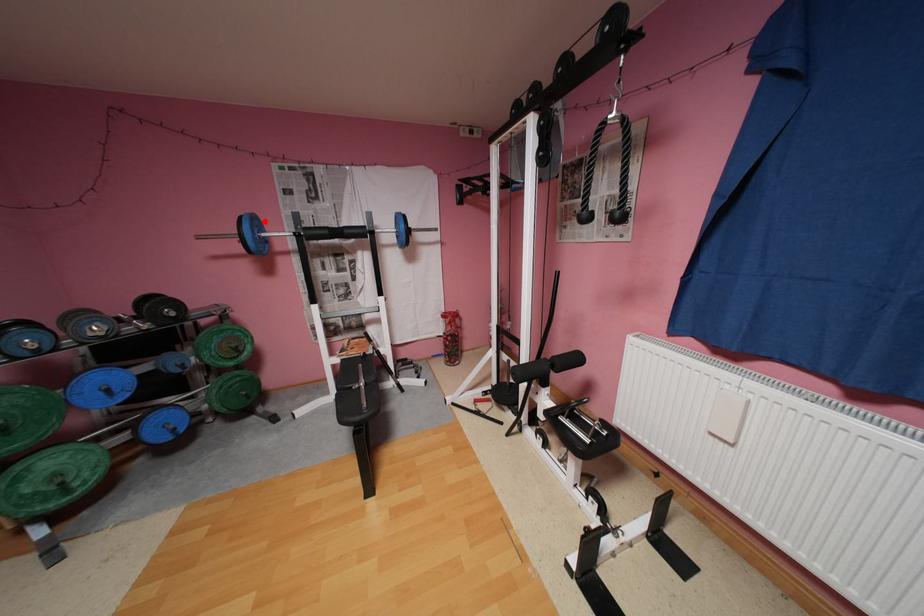
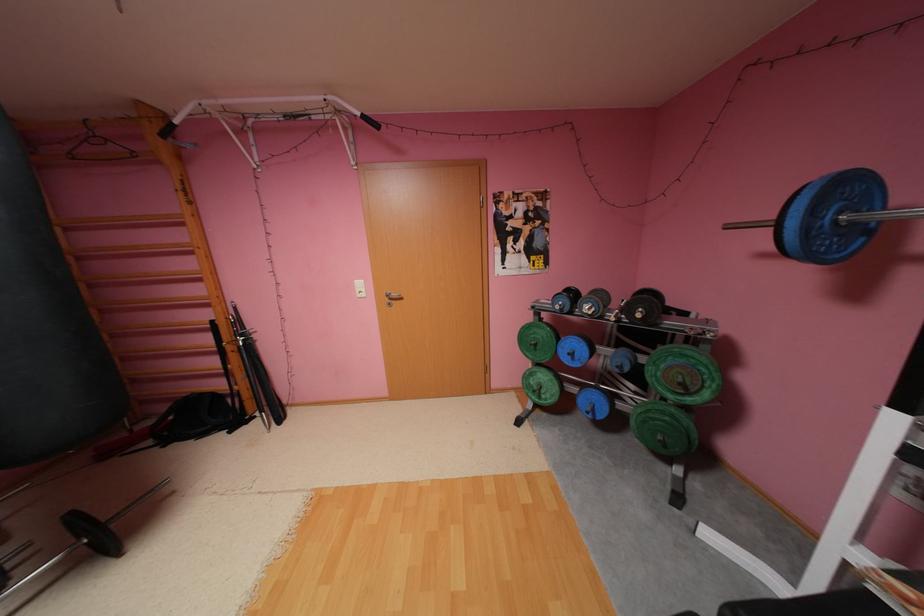
Locate, in the second image, the point that corresponds to the highlighted location in the first image.

(855, 188)